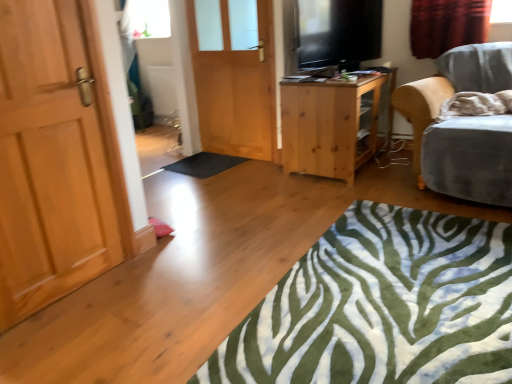
Find the location of a particular element. vacant area that lies between matte wooden door at center, the 1th door positioned from the right, and green zebra-patterned rug at lower center is located at coordinates (262, 210).